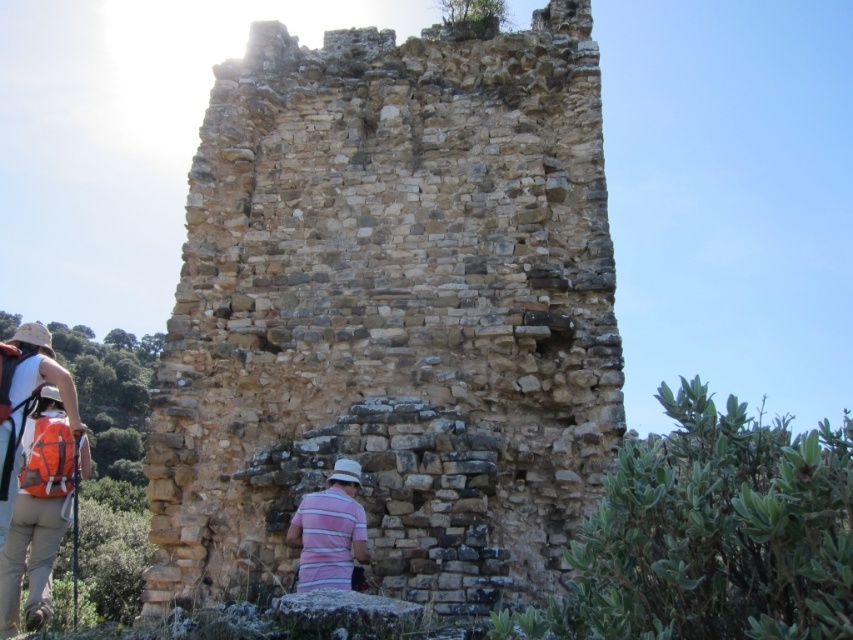
From the picture: You are a tour guide leading a group to explore the brown stone ruins at center. Your group member wearing the striped cotton shirt at lower left is currently standing 16.92 meters away from the ruins. If the safe distance for visitors to approach the ruins is set to 15 meters, should you ask them to move further away?

The distance between the brown stone ruins at center and the striped cotton shirt at lower left is 16.92 meters, which is beyond the 15 meters safe distance requirement. Therefore, there is no need to ask them to move further away.

You are a photographer trying to capture a photo of the brown stone ruins at center and the pink striped shirt at center. From your current position, which object is positioned to the right of the other?

The brown stone ruins at center are to the right of the pink striped shirt at center.

You are a photographer planning to capture a wide shot of the brown stone ruins at center and the pink striped shirt at center. Based on their sizes, which object should you focus on to ensure both are fully visible in the frame?

The brown stone ruins at center is larger than the pink striped shirt at center, so focusing on the brown stone ruins at center will ensure both are fully visible in the frame.